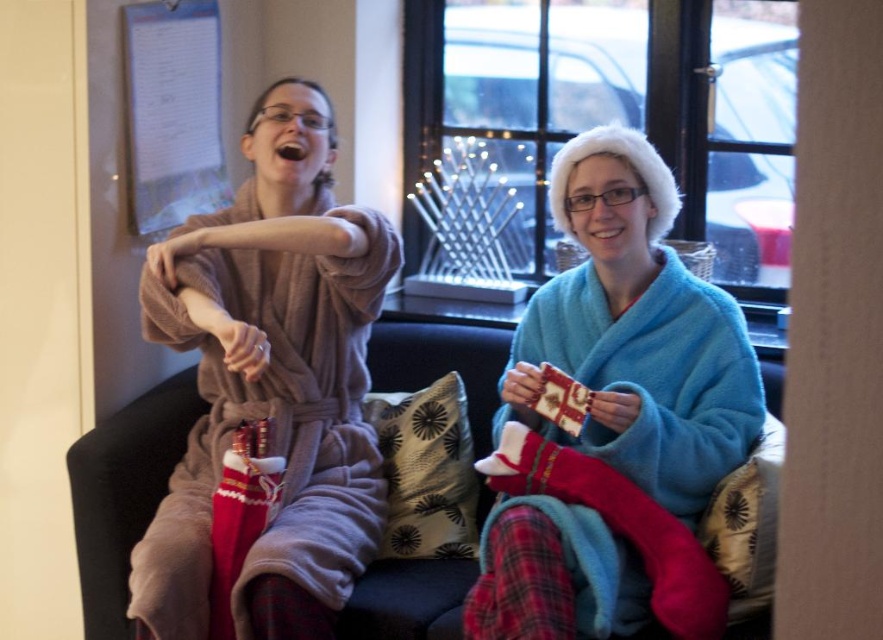
Can you confirm if velvet couch at center is smaller than white paper at upper left?

No.

Is velvet couch at center positioned at the back of white paper at upper left?

That is False.

Between point (383, 579) and point (159, 209), which one is positioned behind?

Positioned behind is point (159, 209).

Identify the location of velvet couch at center. The width and height of the screenshot is (883, 640). click(125, 492).

Is blue fuzzy robe at center smaller than white paper at upper left?

No, blue fuzzy robe at center is not smaller than white paper at upper left.

Which of these two, blue fuzzy robe at center or white paper at upper left, stands taller?

blue fuzzy robe at center is taller.

Identify the location of blue fuzzy robe at center. click(x=636, y=332).

At what (x,y) coordinates should I click in order to perform the action: click on blue fuzzy robe at center. Please return your answer as a coordinate pair (x, y). Looking at the image, I should click on (636, 332).

Does soft brown robe at left appear over white paper at upper left?

No.

Where is `soft brown robe at left`? The image size is (883, 640). soft brown robe at left is located at coordinates (272, 422).

Is point (318, 520) in front of point (160, 180)?

Yes, point (318, 520) is closer to viewer.

The image size is (883, 640). I want to click on soft brown robe at left, so click(x=272, y=422).